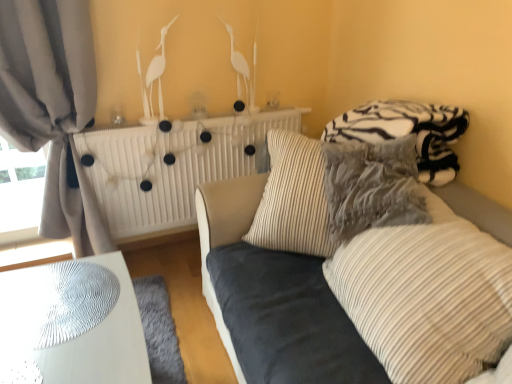
Question: Is velvet blue couch at center beside zebra-patterned fleece blanket at upper right?

Choices:
 (A) no
 (B) yes

Answer: (A)

Question: Is the depth of velvet blue couch at center less than that of zebra-patterned fleece blanket at upper right?

Choices:
 (A) no
 (B) yes

Answer: (B)

Question: Is velvet blue couch at center oriented away from zebra-patterned fleece blanket at upper right?

Choices:
 (A) yes
 (B) no

Answer: (B)

Question: Is velvet blue couch at center oriented towards zebra-patterned fleece blanket at upper right?

Choices:
 (A) yes
 (B) no

Answer: (B)

Question: Can you confirm if velvet blue couch at center is positioned to the left of zebra-patterned fleece blanket at upper right?

Choices:
 (A) no
 (B) yes

Answer: (B)

Question: Is the position of velvet blue couch at center more distant than that of zebra-patterned fleece blanket at upper right?

Choices:
 (A) no
 (B) yes

Answer: (A)

Question: From a real-world perspective, is white matte radiator at upper center positioned over velvet blue couch at center based on gravity?

Choices:
 (A) no
 (B) yes

Answer: (B)

Question: Are white matte radiator at upper center and velvet blue couch at center beside each other?

Choices:
 (A) no
 (B) yes

Answer: (A)

Question: Is white matte radiator at upper center positioned beyond the bounds of velvet blue couch at center?

Choices:
 (A) yes
 (B) no

Answer: (A)

Question: Is white matte radiator at upper center aimed at velvet blue couch at center?

Choices:
 (A) yes
 (B) no

Answer: (A)

Question: Can you confirm if white matte radiator at upper center is taller than velvet blue couch at center?

Choices:
 (A) no
 (B) yes

Answer: (A)

Question: From a real-world perspective, is white matte radiator at upper center physically below velvet blue couch at center?

Choices:
 (A) no
 (B) yes

Answer: (A)

Question: From the image's perspective, is striped fabric pillow at center, acting as the 1th pillow starting from the front, over striped fabric pillow at center, arranged as the second pillow when viewed from the front?

Choices:
 (A) no
 (B) yes

Answer: (A)